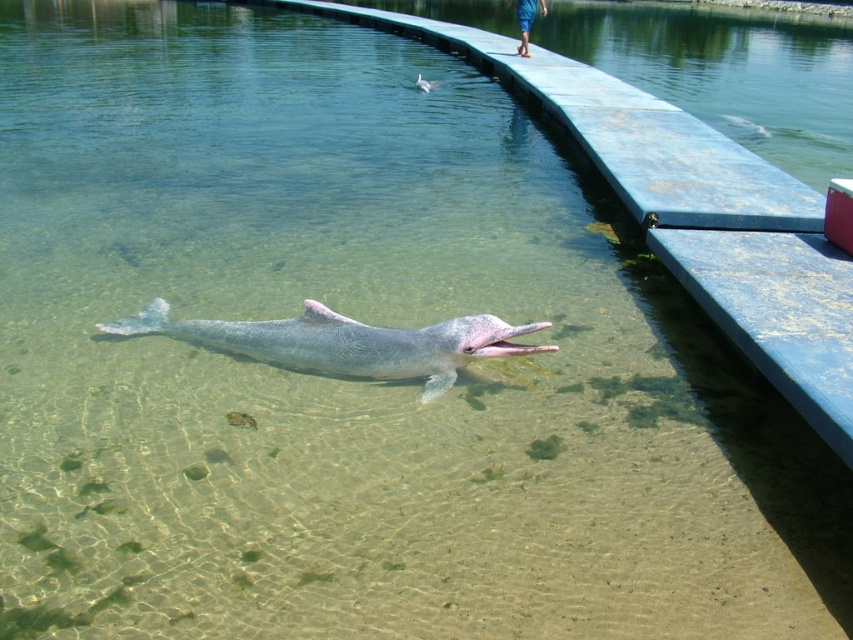
Question: Is gray matte dolphin at center smaller than pink rubber dolphin at center?

Choices:
 (A) yes
 (B) no

Answer: (B)

Question: Which point is farther to the camera?

Choices:
 (A) (148, 314)
 (B) (422, 90)

Answer: (B)

Question: Can you confirm if gray matte dolphin at center is bigger than pink rubber dolphin at center?

Choices:
 (A) no
 (B) yes

Answer: (B)

Question: Which of the following is the farthest from the observer?

Choices:
 (A) gray matte dolphin at center
 (B) pink rubber dolphin at center

Answer: (B)

Question: Is the position of gray matte dolphin at center less distant than that of pink rubber dolphin at center?

Choices:
 (A) no
 (B) yes

Answer: (B)